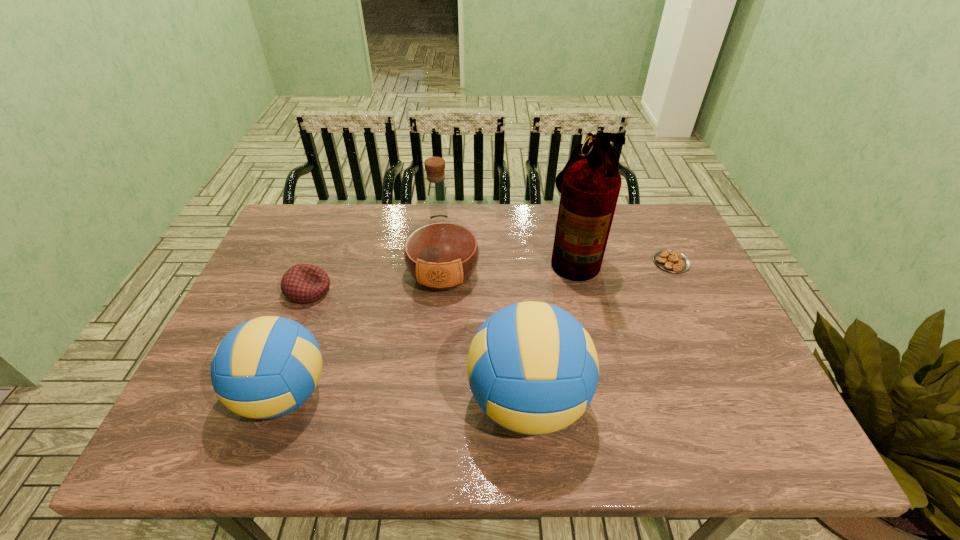
Identify the location of free space located on the back of the right volleyball. (517, 286).

Image resolution: width=960 pixels, height=540 pixels. I want to click on vacant space situated on the front label of the liquor, so click(x=435, y=366).

Where is `vacant space located at the nozzle of the tallest object`? The image size is (960, 540). vacant space located at the nozzle of the tallest object is located at coordinates (457, 254).

This screenshot has width=960, height=540. I want to click on vacant region located at the nozzle of the tallest object, so click(x=493, y=254).

Where is `vacant region located at the nozzle of the tallest object`? The width and height of the screenshot is (960, 540). vacant region located at the nozzle of the tallest object is located at coordinates (444, 254).

Identify the location of vacant space positioned on the right of the beanbag. (424, 291).

Image resolution: width=960 pixels, height=540 pixels. I want to click on free space located on the left of the pastry, so click(x=549, y=262).

The height and width of the screenshot is (540, 960). I want to click on object that is at the far edge, so click(590, 183).

Locate an element on the screen. volleyball at the left edge is located at coordinates (266, 367).

The image size is (960, 540). I want to click on beanbag that is at the left edge, so click(x=303, y=283).